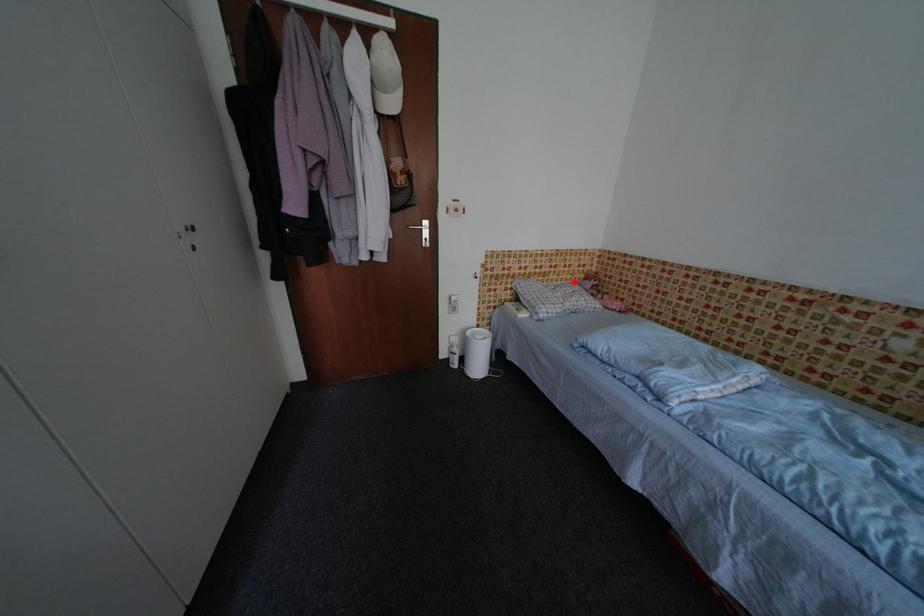
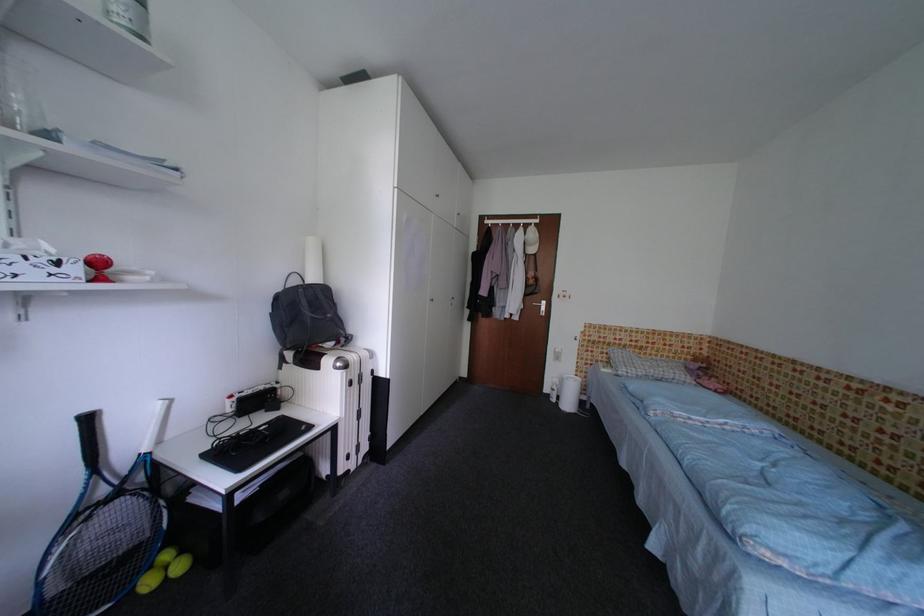
In the second image, find the point that corresponds to the highlighted location in the first image.

(675, 360)